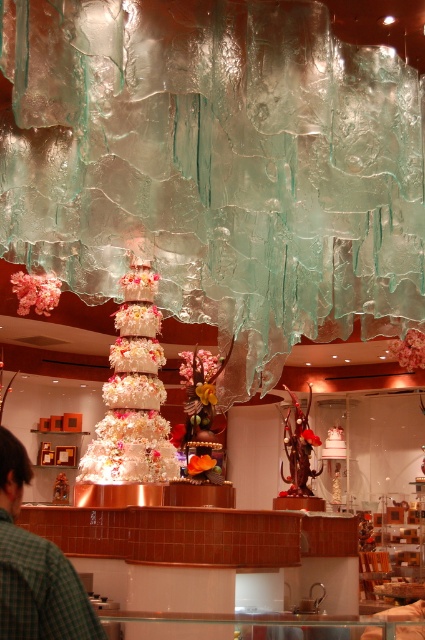
Can you confirm if white textured cake at center is taller than green checkered shirt at lower left?

Yes.

Is point (153, 344) farther from viewer compared to point (19, 544)?

That is True.

What are the coordinates of `white textured cake at center` in the screenshot? It's located at (133, 394).